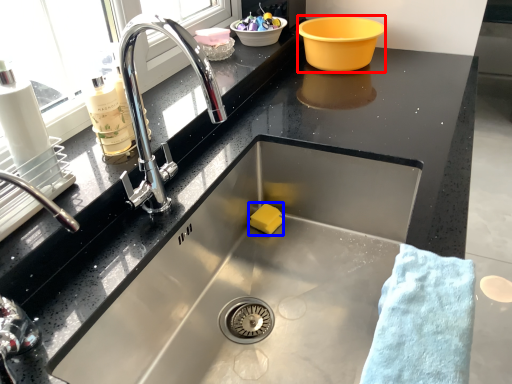
Question: Which object appears closest to the camera in this image, basin (highlighted by a red box) or food (highlighted by a blue box)?

Choices:
 (A) basin
 (B) food

Answer: (B)